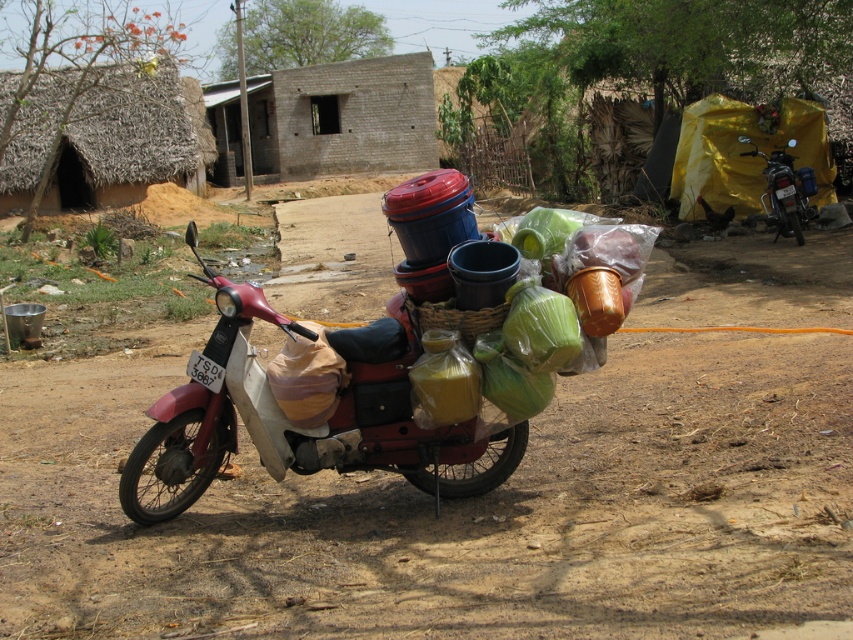
Question: Which point appears farthest from the camera in this image?

Choices:
 (A) (216, 282)
 (B) (810, 180)

Answer: (B)

Question: Does metallic red scooter at center have a lesser width compared to metallic silver motorcycle at right?

Choices:
 (A) no
 (B) yes

Answer: (A)

Question: Which point is closer to the camera?

Choices:
 (A) (396, 396)
 (B) (808, 182)

Answer: (A)

Question: Which object is farther from the camera taking this photo?

Choices:
 (A) metallic red scooter at center
 (B) metallic silver motorcycle at right

Answer: (B)

Question: Does metallic red scooter at center have a smaller size compared to metallic silver motorcycle at right?

Choices:
 (A) no
 (B) yes

Answer: (B)

Question: Does metallic red scooter at center appear on the right side of metallic silver motorcycle at right?

Choices:
 (A) yes
 (B) no

Answer: (B)